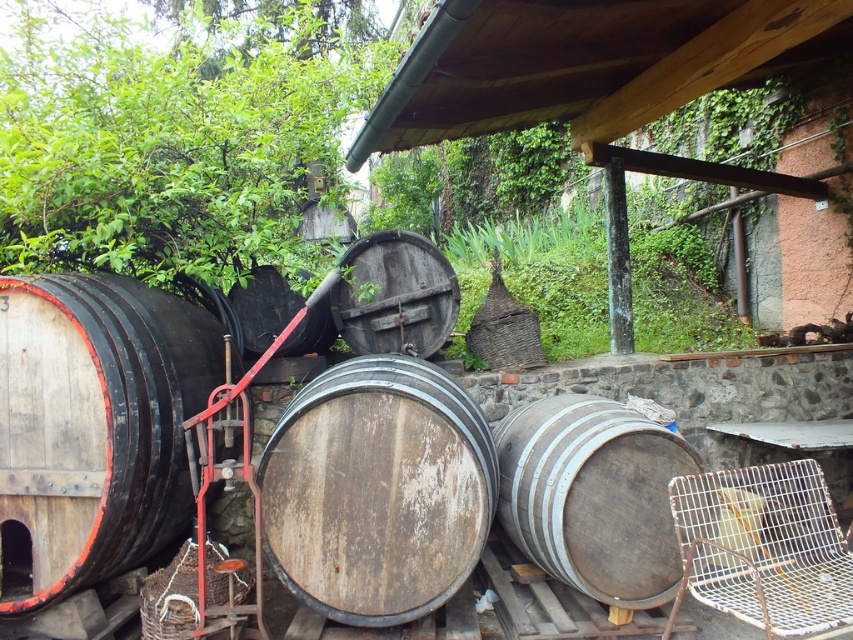
You are an inspector checking the barrels on the stone platform. You notice the weathered wood barrel at center and the dark brown wooden barrel at center. Which one is positioned lower in the stack?

The weathered wood barrel at center is positioned lower in the stack than the dark brown wooden barrel at center, as it is below it.

You are an inspector checking the storage area. You need to determine which barrel has a larger width between the weathered wood barrel at center and the dark brown wooden barrel at center. Which one is wider?

The weathered wood barrel at center has a larger width than the dark brown wooden barrel at center according to the description.

You are a delivery person standing at the camera position in the scene. You need to place a new barrel that is 3 feet in diameter into the existing arrangement. Can you fit it between the weathered wood barrel at center and the camera without moving any other barrels?

The distance between the weathered wood barrel at center and the camera is 10.10 feet. Since the new barrel has a diameter of 3 feet, it requires at least 1.5 feet of space on each side to accommodate its width. Therefore, there is sufficient space to place the new barrel between the weathered wood barrel at center and the camera without moving other barrels.